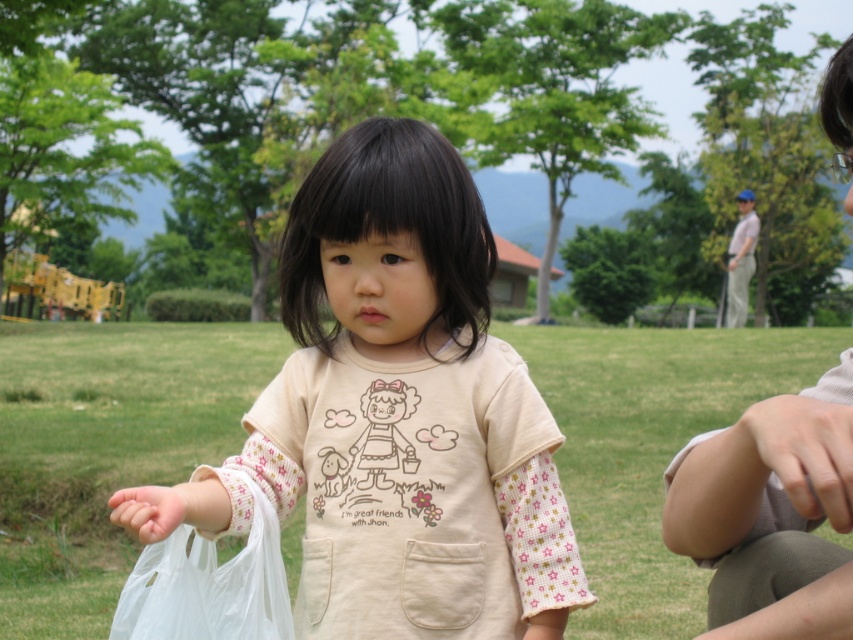
Question: Does beige cotton shirt at center have a smaller size compared to light beige fabric at upper right?

Choices:
 (A) no
 (B) yes

Answer: (B)

Question: Does beige cotton shirt at center have a larger size compared to white fabric hand at lower left?

Choices:
 (A) yes
 (B) no

Answer: (A)

Question: Which point is closer to the camera taking this photo?

Choices:
 (A) (138, 529)
 (B) (762, 413)

Answer: (B)

Question: Which object appears closest to the camera in this image?

Choices:
 (A) light beige fabric at upper right
 (B) transparent plastic bag at lower left
 (C) white fabric hand at lower left
 (D) green grass at center

Answer: (A)

Question: Among these objects, which one is farthest from the camera?

Choices:
 (A) light beige fabric at upper right
 (B) green grass at center
 (C) beige cotton shirt at center

Answer: (B)

Question: Can you confirm if beige cotton shirt at center is smaller than transparent plastic bag at lower left?

Choices:
 (A) no
 (B) yes

Answer: (A)